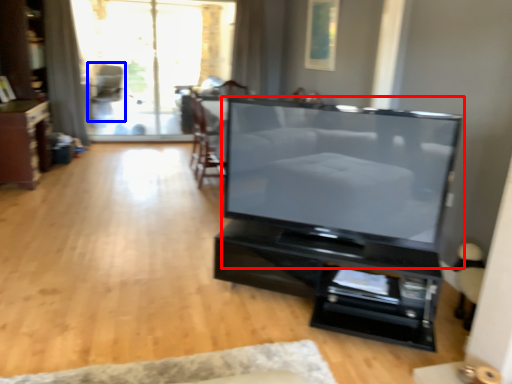
Question: Which point is further to the camera, television (highlighted by a red box) or armchair (highlighted by a blue box)?

Choices:
 (A) television
 (B) armchair

Answer: (B)